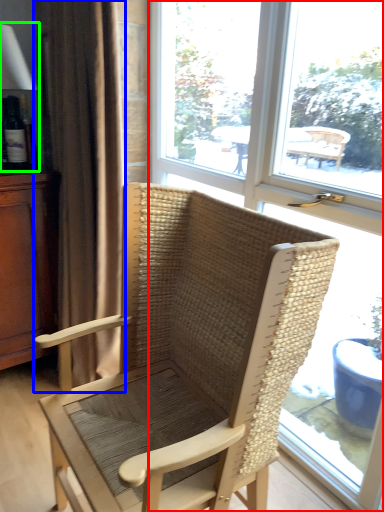
Question: Which object is the closest to the window (highlighted by a red box)? Choose among these: curtain (highlighted by a blue box) or table lamp (highlighted by a green box).

Choices:
 (A) curtain
 (B) table lamp

Answer: (A)